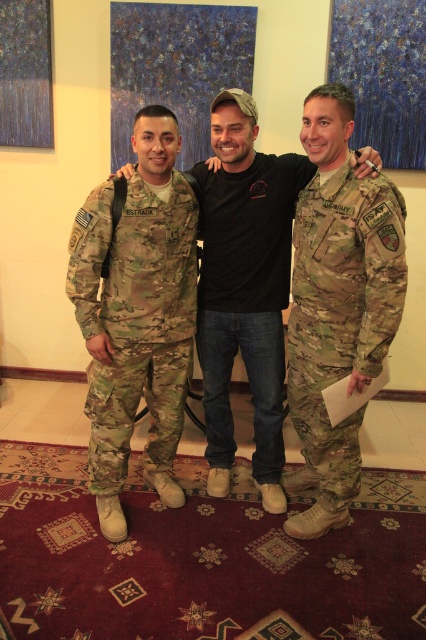
Question: Among these points, which one is nearest to the camera?

Choices:
 (A) (396, 324)
 (B) (152, 273)

Answer: (A)

Question: Based on their relative distances, which object is farther from the camouflage uniform at center?

Choices:
 (A) camouflage fabric uniform at right
 (B) black cotton t-shirt at center
 (C) camouflage fabric uniform at left

Answer: (C)

Question: Can you confirm if camouflage fabric uniform at left is thinner than black cotton t-shirt at center?

Choices:
 (A) yes
 (B) no

Answer: (B)

Question: Does camouflage uniform at center appear on the right side of camouflage fabric uniform at right?

Choices:
 (A) yes
 (B) no

Answer: (B)

Question: Which point is farther from the camera taking this photo?

Choices:
 (A) (282, 358)
 (B) (337, 180)
 (C) (250, 150)

Answer: (A)

Question: Can you confirm if camouflage uniform at center is positioned to the right of black cotton t-shirt at center?

Choices:
 (A) no
 (B) yes

Answer: (A)